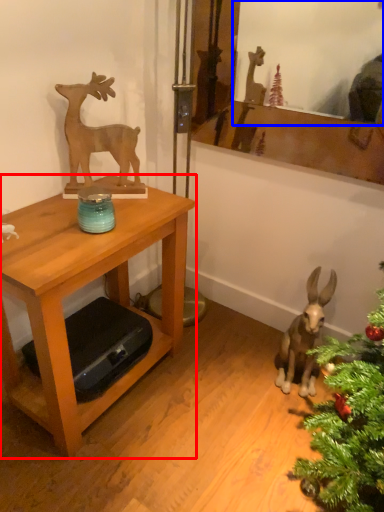
Question: Which object appears closest to the camera in this image, table (highlighted by a red box) or mirror (highlighted by a blue box)?

Choices:
 (A) table
 (B) mirror

Answer: (A)